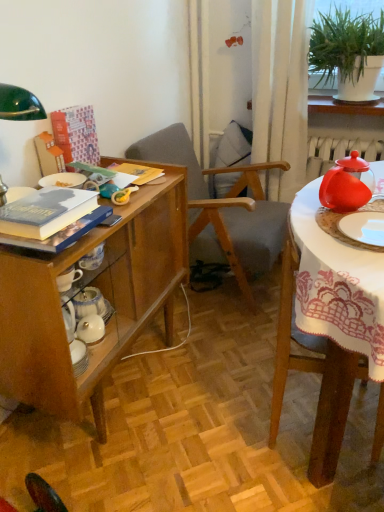
Question: Is white sheer curtain at upper right wider or thinner than white glossy plate at right, arranged as the second tableware when viewed from the top?

Choices:
 (A) thin
 (B) wide

Answer: (B)

Question: From a real-world perspective, relative to white glossy plate at right, arranged as the 1th tableware when ordered from the bottom, is white sheer curtain at upper right vertically above or below?

Choices:
 (A) above
 (B) below

Answer: (A)

Question: Considering the real-world distances, which object is closest to the green leafy plant at upper right?

Choices:
 (A) wooden chair at center, acting as the first chair starting from the back
 (B) white glossy plate at right, arranged as the 1th tableware when ordered from the bottom
 (C) hardcover book at upper left, positioned as the 1th book in top-to-bottom order
 (D) hardcover book at left, the second book from the back
 (E) shiny red teapot at right, which ranks as the 2th tableware in bottom-to-top order

Answer: (A)

Question: Which of these objects is positioned closest to the hardcover book at upper left, the first book positioned from the back?

Choices:
 (A) wooden chair at right, the second chair in the back-to-front sequence
 (B) white sheer curtain at upper right
 (C) white glossy plate at right, arranged as the 1th tableware when ordered from the bottom
 (D) shiny red teapot at right, which ranks as the 2th tableware in bottom-to-top order
 (E) wooden chair at center, acting as the first chair starting from the back

Answer: (E)